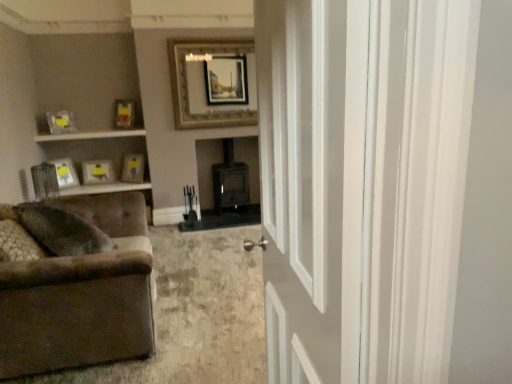
Identify the location of matte yellow picture frame at upper left, acting as the second picture frame starting from the left. The image size is (512, 384). (61, 122).

This screenshot has width=512, height=384. Describe the element at coordinates (124, 114) in the screenshot. I see `matte yellow picture frame at upper left, which is counted as the third picture frame, starting from the right` at that location.

What do you see at coordinates (82, 297) in the screenshot? I see `brown fabric couch at lower left` at bounding box center [82, 297].

Where is `white glossy door at center`? This screenshot has width=512, height=384. white glossy door at center is located at coordinates (312, 183).

The height and width of the screenshot is (384, 512). I want to click on matte yellow picture frame at center, marked as the fifth picture frame in a left-to-right arrangement, so click(133, 168).

From the picture: Is white glossy door at center directly adjacent to matte yellow picture frame at upper left, the third picture frame from the left?

white glossy door at center and matte yellow picture frame at upper left, the third picture frame from the left, are not in contact.

Can you confirm if white glossy door at center is positioned to the right of matte yellow picture frame at upper left, the third picture frame from the left?

Yes, white glossy door at center is to the right of matte yellow picture frame at upper left, the third picture frame from the left.

Who is bigger, white glossy door at center or matte yellow picture frame at upper left, the third picture frame from the left?

Bigger between the two is white glossy door at center.

Between point (330, 129) and point (106, 176), which one is positioned in front?

The point (330, 129) is more forward.

How different are the orientations of matte yellow picture frame at upper left, the 4th picture frame viewed from the left, and brown fabric couch at lower left in degrees?

131 degrees separate the facing orientations of matte yellow picture frame at upper left, the 4th picture frame viewed from the left, and brown fabric couch at lower left.

Is matte yellow picture frame at upper left, the 4th picture frame viewed from the left, to the left of brown fabric couch at lower left from the viewer's perspective?

Yes, matte yellow picture frame at upper left, the 4th picture frame viewed from the left, is to the left of brown fabric couch at lower left.

From a real-world perspective, is matte yellow picture frame at upper left, the 4th picture frame viewed from the left, physically above brown fabric couch at lower left?

Yes.

Which of these two, matte yellow picture frame at upper left, which is counted as the third picture frame, starting from the right, or brown fabric couch at lower left, stands taller?

Standing taller between the two is brown fabric couch at lower left.

Considering the sizes of objects brown fabric couch at lower left and matte silver picture frame at left, the first picture frame viewed from the left, in the image provided, who is shorter, brown fabric couch at lower left or matte silver picture frame at left, the first picture frame viewed from the left,?

matte silver picture frame at left, the first picture frame viewed from the left.

Does brown fabric couch at lower left turn towards matte silver picture frame at left, the 6th picture frame when ordered from right to left?

No, brown fabric couch at lower left is not aimed at matte silver picture frame at left, the 6th picture frame when ordered from right to left.

Are brown fabric couch at lower left and matte silver picture frame at left, the 6th picture frame when ordered from right to left, far apart?

brown fabric couch at lower left is positioned a significant distance from matte silver picture frame at left, the 6th picture frame when ordered from right to left.

In the image, is brown fabric couch at lower left on the left side or the right side of matte silver picture frame at left, the first picture frame viewed from the left?

Clearly, brown fabric couch at lower left is on the right of matte silver picture frame at left, the first picture frame viewed from the left, in the image.

Who is smaller, matte yellow picture frame at upper left, acting as the second picture frame starting from the left, or matte yellow picture frame at center, which is the 2th picture frame in right-to-left order?

matte yellow picture frame at upper left, acting as the second picture frame starting from the left.

Are matte yellow picture frame at upper left, acting as the second picture frame starting from the left, and matte yellow picture frame at center, marked as the fifth picture frame in a left-to-right arrangement, making contact?

No, matte yellow picture frame at upper left, acting as the second picture frame starting from the left, is not in contact with matte yellow picture frame at center, marked as the fifth picture frame in a left-to-right arrangement.

Can you confirm if matte yellow picture frame at upper left, the 5th picture frame viewed from the right, is wider than matte yellow picture frame at center, marked as the fifth picture frame in a left-to-right arrangement?

Incorrect, the width of matte yellow picture frame at upper left, the 5th picture frame viewed from the right, does not surpass that of matte yellow picture frame at center, marked as the fifth picture frame in a left-to-right arrangement.

The image size is (512, 384). I want to click on the 4th picture frame behind the matte yellow picture frame at upper left, acting as the second picture frame starting from the left, starting your count from the anchor, so click(x=133, y=168).

Is matte yellow picture frame at center, marked as the fifth picture frame in a left-to-right arrangement, to the right of matte yellow picture frame at upper left, the third picture frame from the left, from the viewer's perspective?

Correct, you'll find matte yellow picture frame at center, marked as the fifth picture frame in a left-to-right arrangement, to the right of matte yellow picture frame at upper left, the third picture frame from the left.

Find the location of a particular element. the 1st picture frame below when counting from the matte yellow picture frame at center, which is the 2th picture frame in right-to-left order (from the image's perspective) is located at coordinates (97, 172).

Is there a large distance between matte yellow picture frame at center, marked as the fifth picture frame in a left-to-right arrangement, and matte yellow picture frame at upper left, which ranks as the fourth picture frame in right-to-left order?

→ matte yellow picture frame at center, marked as the fifth picture frame in a left-to-right arrangement, is actually quite close to matte yellow picture frame at upper left, which ranks as the fourth picture frame in right-to-left order.

Considering the relative sizes of matte yellow picture frame at center, which is the 2th picture frame in right-to-left order, and matte yellow picture frame at upper left, the third picture frame from the left, in the image provided, is matte yellow picture frame at center, which is the 2th picture frame in right-to-left order, wider than matte yellow picture frame at upper left, the third picture frame from the left,?

No.

Is brown fabric couch at lower left a part of gold metallic picture frame at upper center, which ranks as the 6th picture frame in left-to-right order?

No, brown fabric couch at lower left is not inside gold metallic picture frame at upper center, which ranks as the 6th picture frame in left-to-right order.

From the picture: How many degrees apart are the facing directions of gold metallic picture frame at upper center, which ranks as the first picture frame in right-to-left order, and brown fabric couch at lower left?

90.3 degrees separate the facing orientations of gold metallic picture frame at upper center, which ranks as the first picture frame in right-to-left order, and brown fabric couch at lower left.

Does gold metallic picture frame at upper center, which ranks as the 6th picture frame in left-to-right order, appear on the right side of brown fabric couch at lower left?

Correct, you'll find gold metallic picture frame at upper center, which ranks as the 6th picture frame in left-to-right order, to the right of brown fabric couch at lower left.

How far apart are gold metallic picture frame at upper center, which ranks as the 6th picture frame in left-to-right order, and brown fabric couch at lower left?

gold metallic picture frame at upper center, which ranks as the 6th picture frame in left-to-right order, is 2.84 meters away from brown fabric couch at lower left.

Looking at this image, considering the sizes of objects matte silver picture frame at left, the first picture frame viewed from the left, and matte yellow picture frame at center, which is the 2th picture frame in right-to-left order, in the image provided, who is thinner, matte silver picture frame at left, the first picture frame viewed from the left, or matte yellow picture frame at center, which is the 2th picture frame in right-to-left order,?

matte silver picture frame at left, the first picture frame viewed from the left, is thinner.

Is matte silver picture frame at left, the first picture frame viewed from the left, outside of matte yellow picture frame at center, which is the 2th picture frame in right-to-left order?

Yes, matte silver picture frame at left, the first picture frame viewed from the left, is located beyond the bounds of matte yellow picture frame at center, which is the 2th picture frame in right-to-left order.

Can you confirm if matte silver picture frame at left, the 6th picture frame when ordered from right to left, is bigger than matte yellow picture frame at center, marked as the fifth picture frame in a left-to-right arrangement?

Answer: No, matte silver picture frame at left, the 6th picture frame when ordered from right to left, is not bigger than matte yellow picture frame at center, marked as the fifth picture frame in a left-to-right arrangement.

Which of these two, matte silver picture frame at left, the first picture frame viewed from the left, or matte yellow picture frame at center, marked as the fifth picture frame in a left-to-right arrangement, stands shorter?

With less height is matte yellow picture frame at center, marked as the fifth picture frame in a left-to-right arrangement.

The width and height of the screenshot is (512, 384). There is a white glossy door at center. In order to click on the 3rd picture frame below it (from a real-world perspective) in this screenshot , I will do 97,172.

The image size is (512, 384). I want to click on the 2nd picture frame counting from the left of the brown fabric couch at lower left, so click(x=124, y=114).

From the image, which object appears to be nearer to matte yellow picture frame at upper left, the 5th picture frame viewed from the right, matte yellow picture frame at center, marked as the fifth picture frame in a left-to-right arrangement, or matte yellow picture frame at upper left, which is counted as the third picture frame, starting from the right?

matte yellow picture frame at upper left, which is counted as the third picture frame, starting from the right, is positioned closer to the anchor matte yellow picture frame at upper left, the 5th picture frame viewed from the right.

Estimate the real-world distances between objects in this image. Which object is further from brown fabric couch at lower left, gold metallic picture frame at upper center, which ranks as the first picture frame in right-to-left order, or white glossy door at center?

The object further to brown fabric couch at lower left is gold metallic picture frame at upper center, which ranks as the first picture frame in right-to-left order.

From the image, which object appears to be farther from matte yellow picture frame at center, marked as the fifth picture frame in a left-to-right arrangement, gold metallic picture frame at upper center, which ranks as the 6th picture frame in left-to-right order, or matte yellow picture frame at upper left, the 4th picture frame viewed from the left?

gold metallic picture frame at upper center, which ranks as the 6th picture frame in left-to-right order, lies further to matte yellow picture frame at center, marked as the fifth picture frame in a left-to-right arrangement, than the other object.

Considering their positions, is matte yellow picture frame at center, marked as the fifth picture frame in a left-to-right arrangement, positioned further to matte yellow picture frame at upper left, the third picture frame from the left, than brown fabric couch at lower left?

brown fabric couch at lower left is further to matte yellow picture frame at upper left, the third picture frame from the left.

Which object lies further to the anchor point brown fabric couch at lower left, matte yellow picture frame at center, marked as the fifth picture frame in a left-to-right arrangement, or matte yellow picture frame at upper left, the third picture frame from the left?

Based on the image, matte yellow picture frame at upper left, the third picture frame from the left, appears to be further to brown fabric couch at lower left.

Considering their positions, is matte yellow picture frame at upper left, which is counted as the third picture frame, starting from the right, positioned closer to matte yellow picture frame at upper left, which ranks as the fourth picture frame in right-to-left order, than brown fabric couch at lower left?

matte yellow picture frame at upper left, which is counted as the third picture frame, starting from the right, is closer to matte yellow picture frame at upper left, which ranks as the fourth picture frame in right-to-left order.

Which object lies nearer to the anchor point matte silver picture frame at left, the first picture frame viewed from the left, matte yellow picture frame at upper left, the 4th picture frame viewed from the left, or brown fabric couch at lower left?

matte yellow picture frame at upper left, the 4th picture frame viewed from the left.

Based on the photo, looking at the image, which one is located further to matte silver picture frame at left, the first picture frame viewed from the left, gold metallic picture frame at upper center, which ranks as the 6th picture frame in left-to-right order, or matte yellow picture frame at center, marked as the fifth picture frame in a left-to-right arrangement?

gold metallic picture frame at upper center, which ranks as the 6th picture frame in left-to-right order, is positioned further to the anchor matte silver picture frame at left, the first picture frame viewed from the left.

Locate an element on the screen. The height and width of the screenshot is (384, 512). studio couch located between white glossy door at center and matte yellow picture frame at upper left, which is counted as the third picture frame, starting from the right, in the depth direction is located at coordinates (82, 297).

Where is `picture frame between white glossy door at center and gold metallic picture frame at upper center, which ranks as the 6th picture frame in left-to-right order, in the front-back direction`? The width and height of the screenshot is (512, 384). picture frame between white glossy door at center and gold metallic picture frame at upper center, which ranks as the 6th picture frame in left-to-right order, in the front-back direction is located at coordinates (61, 122).

This screenshot has width=512, height=384. Find the location of `picture frame located between matte yellow picture frame at upper left, which is counted as the third picture frame, starting from the right, and gold metallic picture frame at upper center, which ranks as the 6th picture frame in left-to-right order, in the left-right direction`. picture frame located between matte yellow picture frame at upper left, which is counted as the third picture frame, starting from the right, and gold metallic picture frame at upper center, which ranks as the 6th picture frame in left-to-right order, in the left-right direction is located at coordinates (133, 168).

At what (x,y) coordinates should I click in order to perform the action: click on studio couch located between white glossy door at center and matte silver picture frame at left, the 6th picture frame when ordered from right to left, in the depth direction. Please return your answer as a coordinate pair (x, y). The width and height of the screenshot is (512, 384). Looking at the image, I should click on (82, 297).